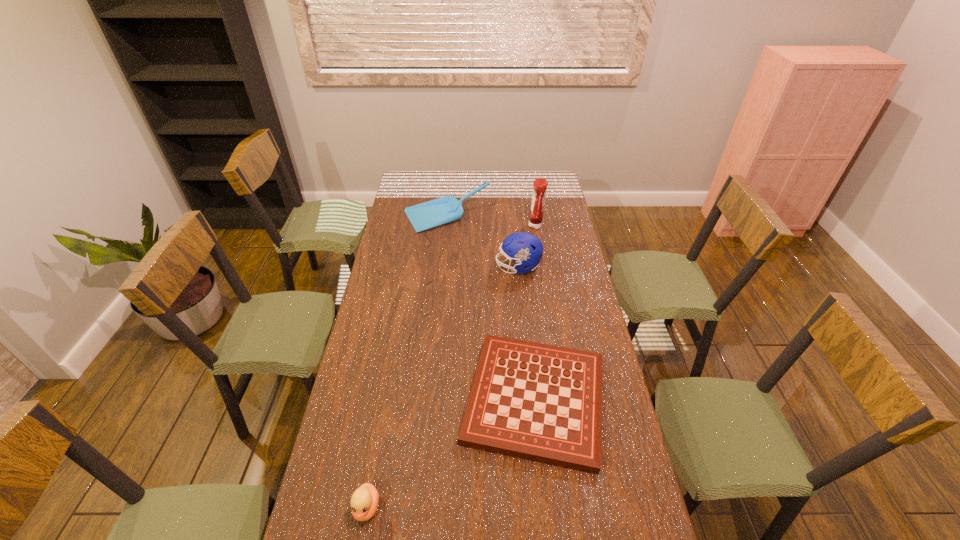
The height and width of the screenshot is (540, 960). Identify the location of free space between the condiment and the second shortest object. (451, 367).

Choose which object is the second nearest neighbor to the second shortest object. Please provide its 2D coordinates. Your answer should be formatted as a tuple, i.e. [(x, y)], where the tuple contains the x and y coordinates of a point satisfying the conditions above.

[(525, 249)]

You are a GUI agent. You are given a task and a screenshot of the screen. Output one action in this format:
    pyautogui.click(x=<x>, y=<y>)
    Task: Click on the closest object to the second nearest object
    This screenshot has height=540, width=960.
    Given the screenshot: What is the action you would take?
    pyautogui.click(x=364, y=502)

Where is `free space that satisfies the following two spatial constraints: 1. on the front side of the second nearest object; 2. on the left side of the dustpan`? free space that satisfies the following two spatial constraints: 1. on the front side of the second nearest object; 2. on the left side of the dustpan is located at coordinates (428, 399).

You are a GUI agent. You are given a task and a screenshot of the screen. Output one action in this format:
    pyautogui.click(x=<x>, y=<y>)
    Task: Click on the vacant region that satisfies the following two spatial constraints: 1. on the face guard of the third farthest object; 2. on the face of the nearest object
    The width and height of the screenshot is (960, 540).
    Given the screenshot: What is the action you would take?
    click(x=542, y=508)

At what (x,y) coordinates should I click in order to perform the action: click on vacant space that satisfies the following two spatial constraints: 1. on the face guard of the fourth shortest object; 2. on the face of the second shortest object. Please return your answer as a coordinate pair (x, y). Looking at the image, I should click on (542, 508).

Where is `free point that satisfies the following two spatial constraints: 1. on the face guard of the third nearest object; 2. on the right side of the fourth farthest object`? This screenshot has width=960, height=540. free point that satisfies the following two spatial constraints: 1. on the face guard of the third nearest object; 2. on the right side of the fourth farthest object is located at coordinates (531, 399).